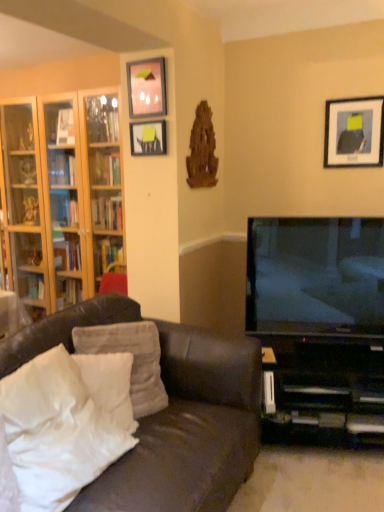
Question: From a real-world perspective, is wooden bookshelf at left over white soft pillow at lower left, which is counted as the third pillow, starting from the front?

Choices:
 (A) no
 (B) yes

Answer: (B)

Question: Does wooden bookshelf at left come in front of white soft pillow at lower left, which is counted as the third pillow, starting from the front?

Choices:
 (A) yes
 (B) no

Answer: (B)

Question: From a real-world perspective, is wooden bookshelf at left positioned under white soft pillow at lower left, which is counted as the third pillow, starting from the front, based on gravity?

Choices:
 (A) no
 (B) yes

Answer: (A)

Question: Would you say wooden bookshelf at left is a long distance from white soft pillow at lower left, which is counted as the third pillow, starting from the front?

Choices:
 (A) yes
 (B) no

Answer: (A)

Question: Could white soft pillow at lower left, which is counted as the third pillow, starting from the front, be considered to be inside wooden bookshelf at left?

Choices:
 (A) no
 (B) yes

Answer: (A)

Question: Do you think clear glass shelves at left is within black plastic entertainment center at lower right, or outside of it?

Choices:
 (A) inside
 (B) outside

Answer: (B)

Question: In terms of width, does clear glass shelves at left look wider or thinner when compared to black plastic entertainment center at lower right?

Choices:
 (A) wide
 (B) thin

Answer: (B)

Question: Considering their positions, is clear glass shelves at left located in front of or behind black plastic entertainment center at lower right?

Choices:
 (A) front
 (B) behind

Answer: (B)

Question: From their relative heights in the image, would you say clear glass shelves at left is taller or shorter than black plastic entertainment center at lower right?

Choices:
 (A) tall
 (B) short

Answer: (A)

Question: Considering the positions of wooden bookshelf at left and matte black picture frame at upper right, the 3th picture frame viewed from the left, in the image, is wooden bookshelf at left wider or thinner than matte black picture frame at upper right, the 3th picture frame viewed from the left,?

Choices:
 (A) thin
 (B) wide

Answer: (B)

Question: Is point (34, 246) positioned closer to the camera than point (347, 121)?

Choices:
 (A) farther
 (B) closer

Answer: (A)

Question: From a real-world perspective, is wooden bookshelf at left physically located above or below matte black picture frame at upper right, marked as the 1th picture frame in a right-to-left arrangement?

Choices:
 (A) above
 (B) below

Answer: (B)

Question: From their relative heights in the image, would you say wooden bookshelf at left is taller or shorter than matte black picture frame at upper right, the 3th picture frame viewed from the left?

Choices:
 (A) tall
 (B) short

Answer: (A)

Question: Considering the positions of matte black tv at right and matte glass picture frame at upper center, the second picture frame positioned from the right, in the image, is matte black tv at right bigger or smaller than matte glass picture frame at upper center, the second picture frame positioned from the right,?

Choices:
 (A) big
 (B) small

Answer: (A)

Question: In the image, is matte black tv at right positioned in front of or behind matte glass picture frame at upper center, the second picture frame positioned from the right?

Choices:
 (A) front
 (B) behind

Answer: (A)